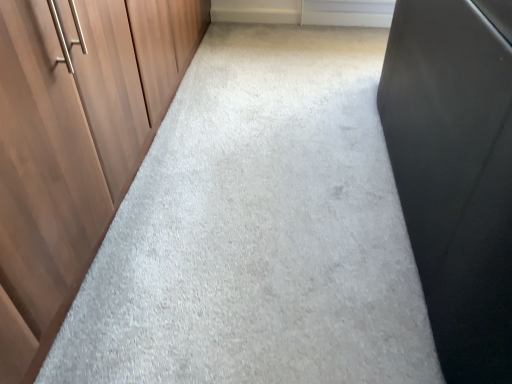
Question: Can you confirm if white matte window at upper center is taller than wooden at left?

Choices:
 (A) yes
 (B) no

Answer: (B)

Question: Can you confirm if white matte window at upper center is wider than wooden at left?

Choices:
 (A) no
 (B) yes

Answer: (A)

Question: Is the position of white matte window at upper center less distant than that of wooden at left?

Choices:
 (A) no
 (B) yes

Answer: (A)

Question: Is white matte window at upper center smaller than wooden at left?

Choices:
 (A) yes
 (B) no

Answer: (A)

Question: Are white matte window at upper center and wooden at left far apart?

Choices:
 (A) no
 (B) yes

Answer: (B)

Question: Is white matte window at upper center outside wooden at left?

Choices:
 (A) yes
 (B) no

Answer: (A)

Question: From a real-world perspective, is wooden at left physically below white matte window at upper center?

Choices:
 (A) yes
 (B) no

Answer: (B)

Question: Considering the relative sizes of wooden at left and white matte window at upper center in the image provided, is wooden at left thinner than white matte window at upper center?

Choices:
 (A) no
 (B) yes

Answer: (A)

Question: Is wooden at left placed right next to white matte window at upper center?

Choices:
 (A) no
 (B) yes

Answer: (A)

Question: Does wooden at left appear on the right side of white matte window at upper center?

Choices:
 (A) no
 (B) yes

Answer: (A)

Question: Can you confirm if wooden at left is wider than white matte window at upper center?

Choices:
 (A) no
 (B) yes

Answer: (B)

Question: From the image's perspective, would you say wooden at left is shown under white matte window at upper center?

Choices:
 (A) yes
 (B) no

Answer: (A)

Question: Looking at their shapes, would you say white matte window at upper center is wider or thinner than wooden at left?

Choices:
 (A) thin
 (B) wide

Answer: (A)